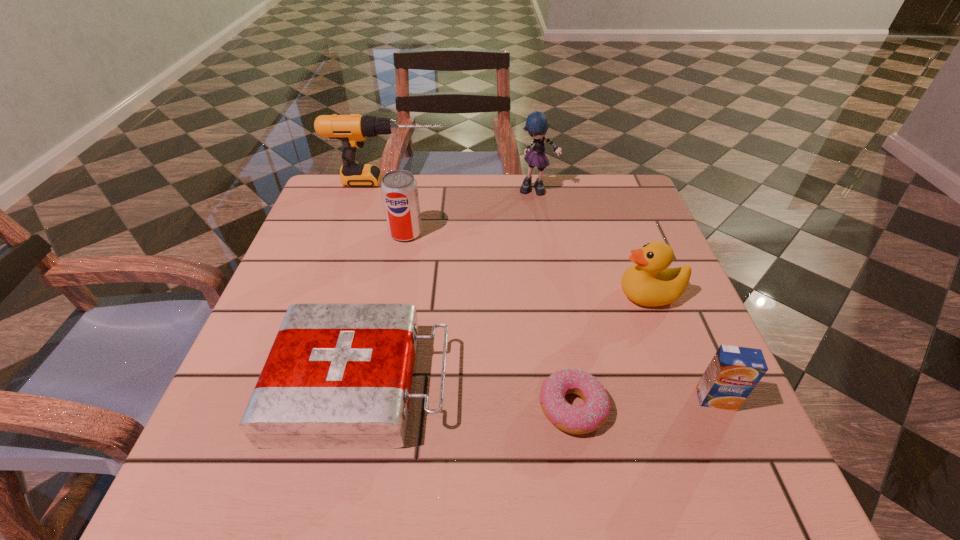
Find the location of a particular element. vacant space at the right edge of the desktop is located at coordinates (643, 229).

Find the location of a particular element. The height and width of the screenshot is (540, 960). vacant space at the far right corner of the desktop is located at coordinates (603, 188).

This screenshot has height=540, width=960. Find the location of `free point between the orange_juice and the second shortest object`. free point between the orange_juice and the second shortest object is located at coordinates (539, 392).

At what (x,y) coordinates should I click in order to perform the action: click on vacant area that lies between the rag doll and the shortest object. Please return your answer as a coordinate pair (x, y). The height and width of the screenshot is (540, 960). Looking at the image, I should click on (555, 299).

Identify the location of vacant area that lies between the shortest object and the first-aid kit. (468, 396).

The image size is (960, 540). What are the coordinates of `free spot between the first-aid kit and the shortest object` in the screenshot? It's located at (468, 396).

You are a GUI agent. You are given a task and a screenshot of the screen. Output one action in this format:
    pyautogui.click(x=<x>, y=<y>)
    Task: Click on the vacant region between the first-aid kit and the drill
    The image size is (960, 540).
    Given the screenshot: What is the action you would take?
    pyautogui.click(x=375, y=283)

The image size is (960, 540). Find the location of `unoccupied position between the shortest object and the orange_juice`. unoccupied position between the shortest object and the orange_juice is located at coordinates (644, 403).

Where is `vacant area between the drill and the orange_juice`? vacant area between the drill and the orange_juice is located at coordinates coord(552,290).

Where is `free space that is in between the duck and the soda`? The height and width of the screenshot is (540, 960). free space that is in between the duck and the soda is located at coordinates (528, 264).